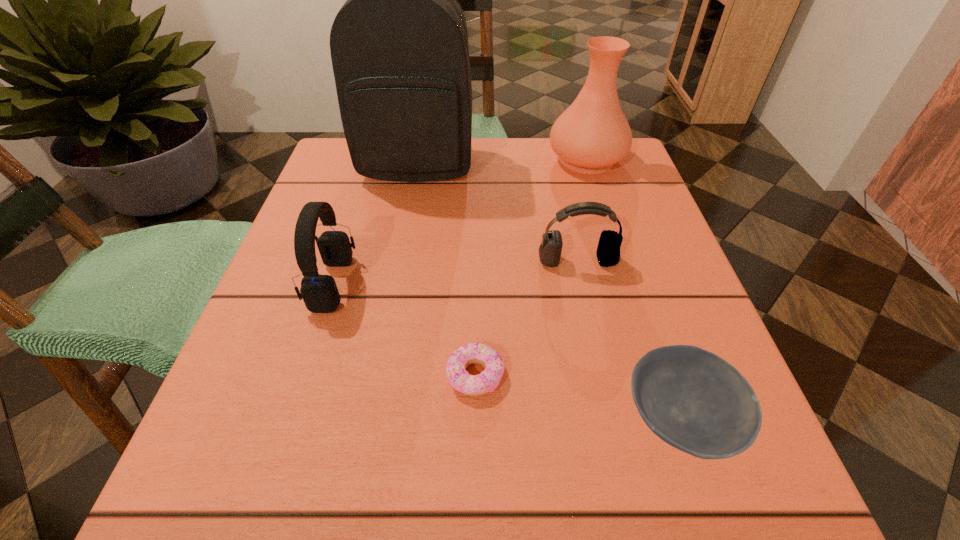
This screenshot has width=960, height=540. In order to click on vacant point located on the headband of the third tallest object in this screenshot , I will do `click(493, 284)`.

The width and height of the screenshot is (960, 540). In order to click on free space located 0.190m on the headband of the third shortest object in this screenshot , I will do `click(599, 361)`.

At what (x,y) coordinates should I click in order to perform the action: click on free space located 0.380m on the left of the fifth tallest object. Please return your answer as a coordinate pair (x, y). This screenshot has height=540, width=960. Looking at the image, I should click on (333, 420).

Image resolution: width=960 pixels, height=540 pixels. In order to click on free space located on the left of the shortest object in this screenshot , I will do `click(355, 375)`.

What are the coordinates of `backpack situated at the far edge` in the screenshot? It's located at (399, 47).

Identify the location of vase at the far edge. click(x=592, y=134).

Locate an element on the screen. object situated at the near edge is located at coordinates (692, 399).

What are the coordinates of `backpack situated at the left edge` in the screenshot? It's located at (399, 47).

Find the location of a particular element. This screenshot has width=960, height=540. headset present at the left edge is located at coordinates (320, 294).

Identify the location of vase present at the right edge. Image resolution: width=960 pixels, height=540 pixels. (592, 134).